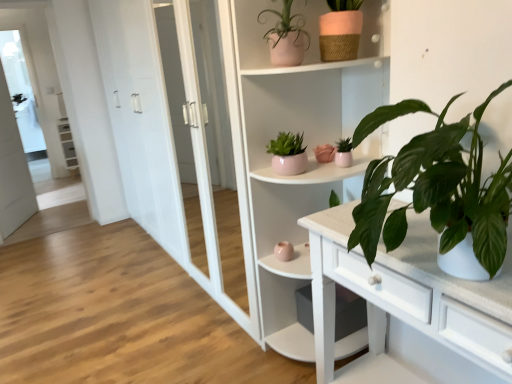
Question: From the image's perspective, relative to matte gray cabinet at left, is white matte bookshelf at center above or below?

Choices:
 (A) above
 (B) below

Answer: (B)

Question: Based on their positions, is white matte bookshelf at center located to the left or right of matte gray cabinet at left?

Choices:
 (A) left
 (B) right

Answer: (B)

Question: Based on their relative distances, which object is nearer to the matte pink pot at center, which is counted as the 3th houseplant, starting from the top?

Choices:
 (A) green leafy plant at right, which is counted as the fourth houseplant, starting from the top
 (B) matte pink pot at upper center, which is the 1th houseplant in top-to-bottom order
 (C) matte pink pot at upper center, marked as the second houseplant in a top-to-bottom arrangement
 (D) matte gray cabinet at left
 (E) white matte bookshelf at center

Answer: (C)

Question: Estimate the real-world distances between objects in this image. Which object is farther from the matte gray cabinet at left?

Choices:
 (A) white glass screen door at left
 (B) green leafy plant at right, which is counted as the fourth houseplant, starting from the top
 (C) white glass window at upper left
 (D) white matte bookshelf at center
 (E) matte pink pot at upper center, marked as the second houseplant in a top-to-bottom arrangement

Answer: (B)